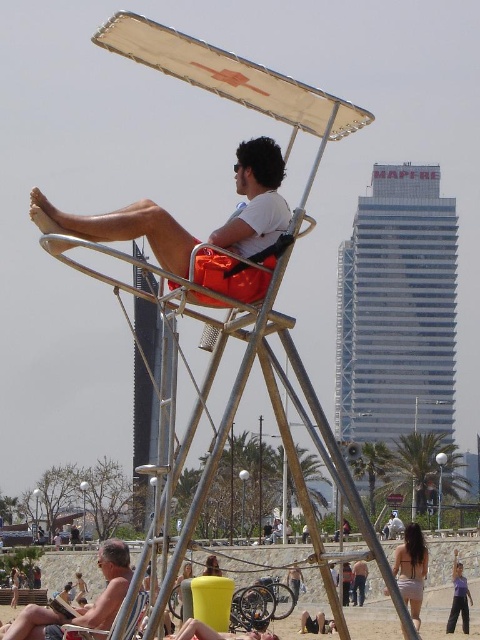
Does matte orange life preserver at center have a lesser height compared to smooth black surfboard at center?

No, matte orange life preserver at center is not shorter than smooth black surfboard at center.

In the scene shown: Is matte orange life preserver at center further to camera compared to smooth black surfboard at center?

No.

Where is `matte orange life preserver at center`? This screenshot has height=640, width=480. matte orange life preserver at center is located at coordinates (255, 200).

Does metallic silver chair at center appear under white cotton shirt at center?

Incorrect, metallic silver chair at center is not positioned below white cotton shirt at center.

Locate an element on the screen. metallic silver chair at center is located at coordinates click(136, 614).

Between matte orange shorts at center and purple fabric pants at lower right, which one appears on the left side from the viewer's perspective?

From the viewer's perspective, matte orange shorts at center appears more on the left side.

Can you confirm if matte orange shorts at center is positioned below purple fabric pants at lower right?

Incorrect, matte orange shorts at center is not positioned below purple fabric pants at lower right.

Which is in front, point (22, 618) or point (462, 621)?

Point (22, 618)

Locate an element on the screen. This screenshot has height=640, width=480. matte orange shorts at center is located at coordinates (82, 605).